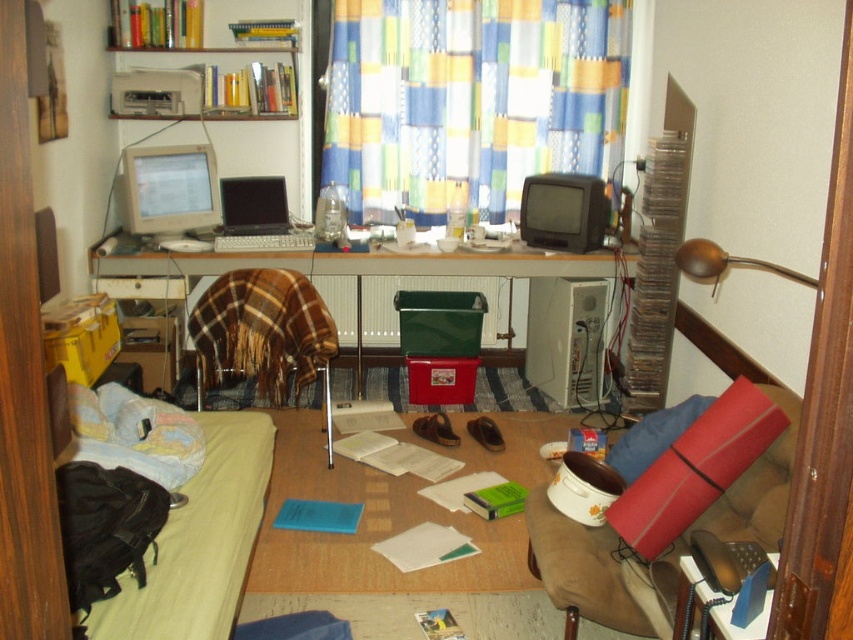
Is plaid fabric chair at center wider than matte black laptop at center?

Yes.

In the scene shown: Can you confirm if plaid fabric chair at center is positioned below matte black laptop at center?

Indeed, plaid fabric chair at center is positioned under matte black laptop at center.

Find the location of a particular element. This screenshot has height=640, width=853. plaid fabric chair at center is located at coordinates (264, 336).

Does matte plastic computer desk at center have a lesser width compared to white plastic desktop computer at center?

No, matte plastic computer desk at center is not thinner than white plastic desktop computer at center.

Which is in front, point (321, 280) or point (555, 316)?

Point (555, 316) is more forward.

At what (x,y) coordinates should I click in order to perform the action: click on matte plastic computer desk at center. Please return your answer as a coordinate pair (x, y). The image size is (853, 640). Looking at the image, I should click on (372, 282).

In the scene shown: Who is more forward, [259,262] or [113,8]?

Point [259,262] is in front.

Where is `matte plastic computer desk at center`? This screenshot has height=640, width=853. matte plastic computer desk at center is located at coordinates (372, 282).

Between point (387, 310) and point (136, 106), which one is positioned in front?

Point (136, 106) is more forward.

Where is `matte plastic computer desk at center`? matte plastic computer desk at center is located at coordinates (372, 282).